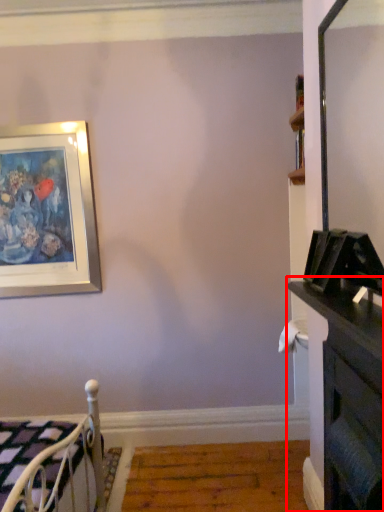
Question: Where is dresser (annotated by the red box) located in relation to furniture in the image?

Choices:
 (A) left
 (B) right

Answer: (B)